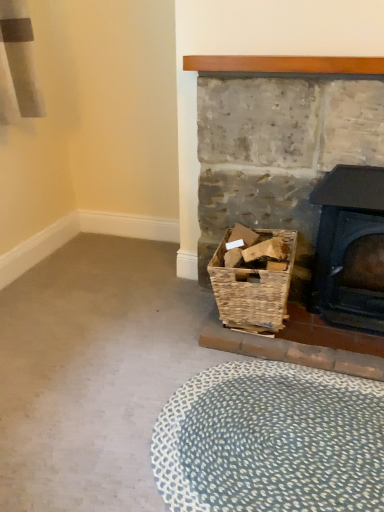
Question: From a real-world perspective, does woven brown basket at lower right sit lower than rustic wicker basket at lower right?

Choices:
 (A) no
 (B) yes

Answer: (B)

Question: From the image's perspective, would you say woven brown basket at lower right is positioned over rustic wicker basket at lower right?

Choices:
 (A) no
 (B) yes

Answer: (A)

Question: Is woven brown basket at lower right bigger than rustic wicker basket at lower right?

Choices:
 (A) yes
 (B) no

Answer: (B)

Question: Does woven brown basket at lower right come in front of rustic wicker basket at lower right?

Choices:
 (A) no
 (B) yes

Answer: (A)

Question: Can you confirm if woven brown basket at lower right is thinner than rustic wicker basket at lower right?

Choices:
 (A) yes
 (B) no

Answer: (B)

Question: Can you confirm if woven brown basket at lower right is wider than rustic wicker basket at lower right?

Choices:
 (A) no
 (B) yes

Answer: (B)

Question: Does blue textured rug at lower center lie behind rustic wicker basket at lower right?

Choices:
 (A) no
 (B) yes

Answer: (A)

Question: Is blue textured rug at lower center positioned beyond the bounds of rustic wicker basket at lower right?

Choices:
 (A) yes
 (B) no

Answer: (A)

Question: Considering the relative sizes of blue textured rug at lower center and rustic wicker basket at lower right in the image provided, is blue textured rug at lower center wider than rustic wicker basket at lower right?

Choices:
 (A) no
 (B) yes

Answer: (B)

Question: Does blue textured rug at lower center turn towards rustic wicker basket at lower right?

Choices:
 (A) no
 (B) yes

Answer: (A)

Question: Is the depth of blue textured rug at lower center less than that of rustic wicker basket at lower right?

Choices:
 (A) yes
 (B) no

Answer: (A)

Question: Does blue textured rug at lower center have a lesser height compared to rustic wicker basket at lower right?

Choices:
 (A) no
 (B) yes

Answer: (B)

Question: Can you confirm if woven brown basket at lower right is thinner than black cast iron wood burning stove at right?

Choices:
 (A) yes
 (B) no

Answer: (B)